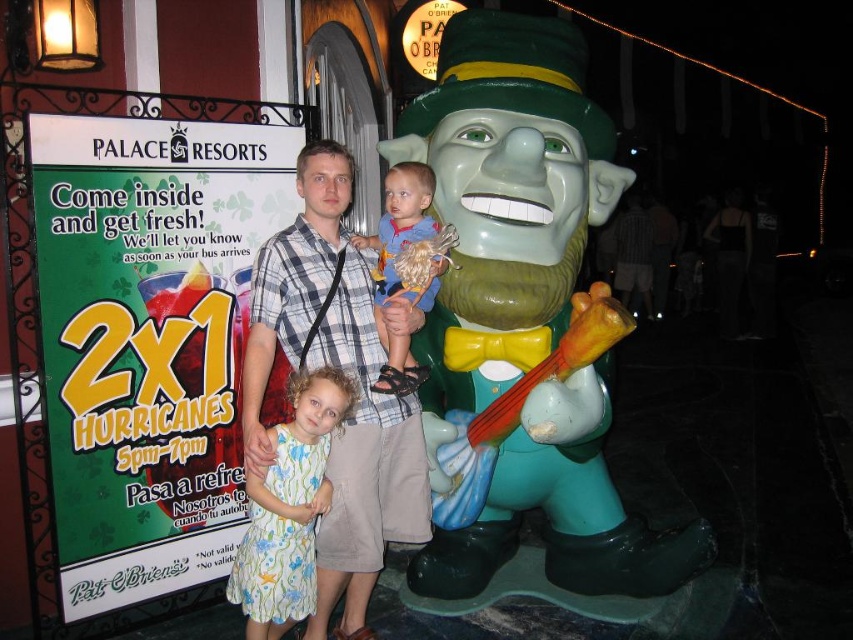
Which is behind, point (607, 522) or point (381, 218)?

Point (607, 522)

Who is positioned more to the right, green painted statue at right or blue cotton shirt at center?

green painted statue at right

Who is more forward, (473, 312) or (392, 280)?

Point (473, 312) is more forward.

This screenshot has width=853, height=640. I want to click on green painted statue at right, so pos(506,195).

In the scene shown: Is floral cotton dress at center above blue cotton shirt at center?

No.

Is the position of floral cotton dress at center more distant than that of blue cotton shirt at center?

No, it is not.

Locate an element on the screen. floral cotton dress at center is located at coordinates (289, 508).

I want to click on floral cotton dress at center, so click(x=289, y=508).

Is green painted statue at right to the left of floral cotton dress at center from the viewer's perspective?

No, green painted statue at right is not to the left of floral cotton dress at center.

Which is in front, point (498, 534) or point (254, 552)?

Positioned in front is point (254, 552).

You are a GUI agent. You are given a task and a screenshot of the screen. Output one action in this format:
    pyautogui.click(x=<x>, y=<y>)
    Task: Click on the green painted statue at right
    The height and width of the screenshot is (640, 853).
    Given the screenshot: What is the action you would take?
    pyautogui.click(x=506, y=195)